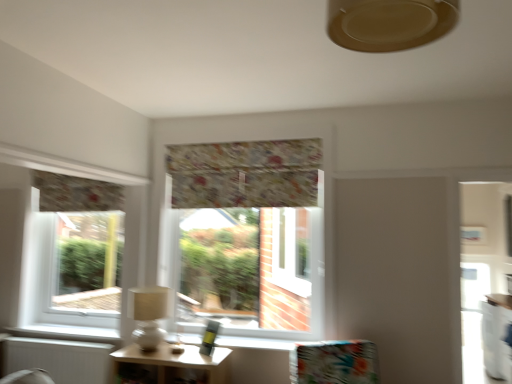
Question: Is white glossy counter at lower right next to beige matte ceiling fan at upper center and touching it?

Choices:
 (A) no
 (B) yes

Answer: (A)

Question: Does white glossy counter at lower right appear on the left side of beige matte ceiling fan at upper center?

Choices:
 (A) yes
 (B) no

Answer: (B)

Question: From the image's perspective, is white glossy counter at lower right below beige matte ceiling fan at upper center?

Choices:
 (A) yes
 (B) no

Answer: (A)

Question: Is white glossy counter at lower right positioned with its back to beige matte ceiling fan at upper center?

Choices:
 (A) no
 (B) yes

Answer: (A)

Question: Is white glossy counter at lower right located outside beige matte ceiling fan at upper center?

Choices:
 (A) no
 (B) yes

Answer: (B)

Question: Is white glossy counter at lower right facing towards beige matte ceiling fan at upper center?

Choices:
 (A) yes
 (B) no

Answer: (B)

Question: Is white matte radiator at lower left at the left side of floral fabric curtain at left, which is the second curtain from right to left?

Choices:
 (A) yes
 (B) no

Answer: (A)

Question: Can you confirm if white matte radiator at lower left is positioned to the right of floral fabric curtain at left, which is the first curtain in left-to-right order?

Choices:
 (A) no
 (B) yes

Answer: (A)

Question: Is white matte radiator at lower left thinner than floral fabric curtain at left, which appears as the second curtain when viewed from the front?

Choices:
 (A) no
 (B) yes

Answer: (A)

Question: From a real-world perspective, is white matte radiator at lower left located higher than floral fabric curtain at left, marked as the 1th curtain in a back-to-front arrangement?

Choices:
 (A) yes
 (B) no

Answer: (B)

Question: From a real-world perspective, is white matte radiator at lower left physically below floral fabric curtain at left, which appears as the second curtain when viewed from the front?

Choices:
 (A) yes
 (B) no

Answer: (A)

Question: Is white matte radiator at lower left facing away from floral fabric curtain at left, which appears as the second curtain when viewed from the front?

Choices:
 (A) no
 (B) yes

Answer: (A)

Question: Is wooden table at lower center thinner than floral fabric valance at center, the second window positioned from the left?

Choices:
 (A) yes
 (B) no

Answer: (B)